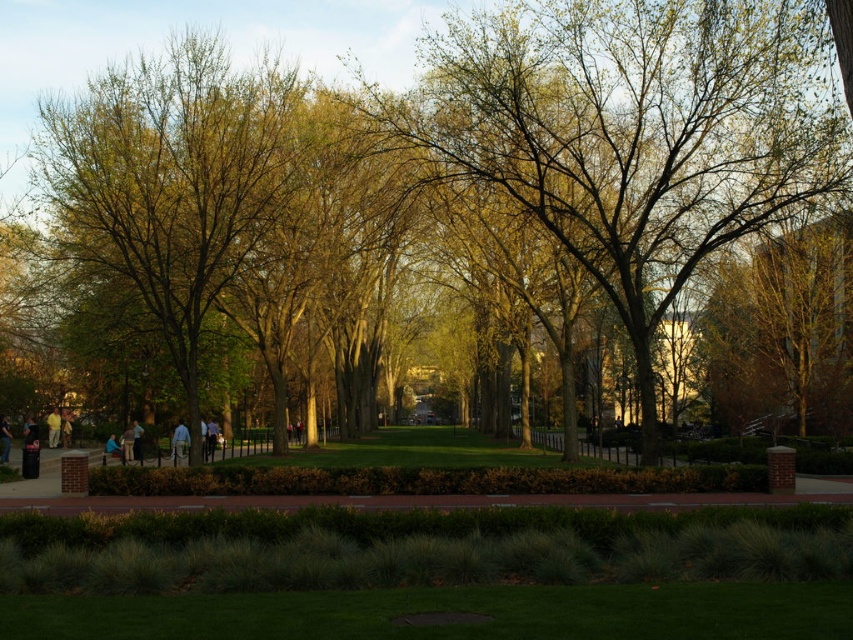
You are standing on the paved pathway in the park and want to walk towards the point labeled as point (70, 186). However, there is an obstacle at point (27, 307). Will you encounter the obstacle before reaching your destination?

Yes, you will encounter the obstacle at point (27, 307) before reaching your destination at point (70, 186) because point (27, 307) is closer to you than point (70, 186).